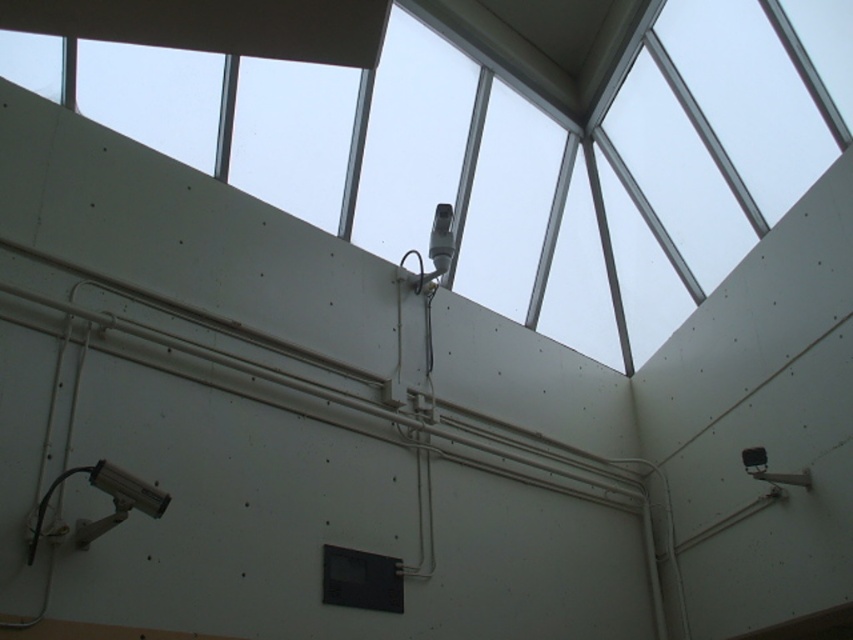
You are standing in the room and want to determine which of the two points, point (730, 16) or point (390, 595), is closer to you. Based on the coordinates provided, which point is nearer?

Point (730, 16) is further to the viewer than point (390, 595), so the closer point is point (390, 595).

You are a maintenance worker needing to replace a broken window. You have a ladder that is 6 feet long. The transparent glass window at upper center and the black matte window at center are 7.36 feet apart. Can you reach both windows with your ladder?

The transparent glass window at upper center and black matte window at center are 7.36 feet apart, so the ladder that is 6 feet long is shorter than the distance between them. You cannot reach both windows with your ladder.

You are an interior designer planning to install a new light fixture. You have two options available. The first is a large chandelier that requires 1.2 meters of vertical clearance. The second is a smaller pendant light needing only 0.8 meters. Based on the heights of the transparent glass window at upper center and the black matte window at center, which option would you recommend?

The transparent glass window at upper center is taller than the black matte window at center. Since the large chandelier requires 1.2 meters of vertical clearance, it would be suitable for the transparent glass window at upper center due to its greater height. The smaller pendant light needing 0.8 meters could also work there, but the larger option is feasible if space allows. However, the black matte window at center may not have enough height for the chandelier, so the pendant light would be safer there.